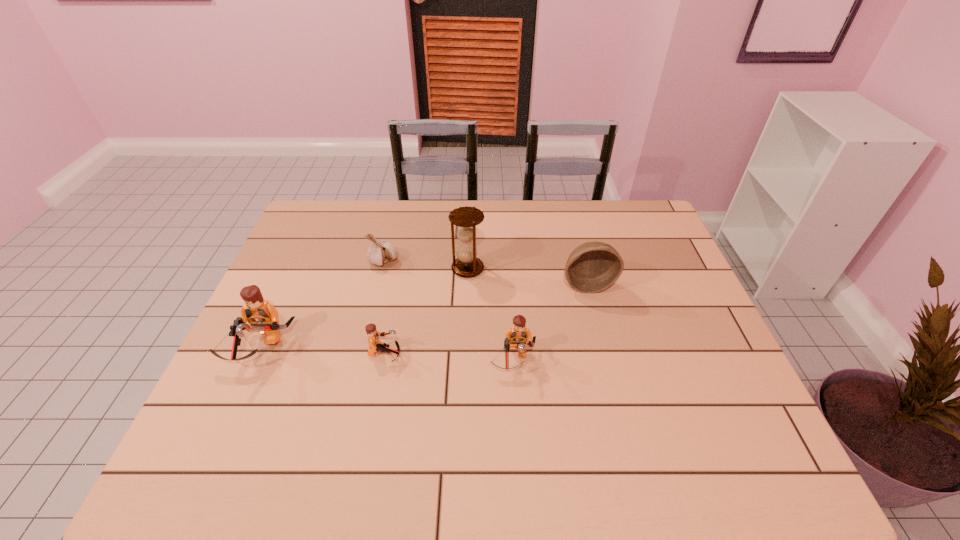
This screenshot has height=540, width=960. Identify the location of free space located holding a crossbow in the hands of the second shortest Lego. (516, 413).

Locate an element on the screen. This screenshot has width=960, height=540. vacant region located on the front of the rightmost object is located at coordinates (x=594, y=309).

The height and width of the screenshot is (540, 960). Find the location of `vacant space located on the back of the garlic`. vacant space located on the back of the garlic is located at coordinates (392, 229).

I want to click on vacant space located on the front of the third object from right to left, so click(467, 307).

Locate an element on the screen. This screenshot has height=540, width=960. object at the left edge is located at coordinates (263, 317).

The height and width of the screenshot is (540, 960). I want to click on vacant space at the far edge of the desktop, so tap(493, 241).

At what (x,y) coordinates should I click in order to perform the action: click on free region at the near edge of the desktop. Please return your answer as a coordinate pair (x, y). This screenshot has height=540, width=960. Looking at the image, I should click on (566, 400).

Where is `vacant space at the left edge of the desktop`? vacant space at the left edge of the desktop is located at coordinates (300, 340).

Identify the location of free region at the right edge of the desktop. Image resolution: width=960 pixels, height=540 pixels. (674, 366).

This screenshot has width=960, height=540. What are the coordinates of `vacant space at the far left corner` in the screenshot? It's located at (337, 241).